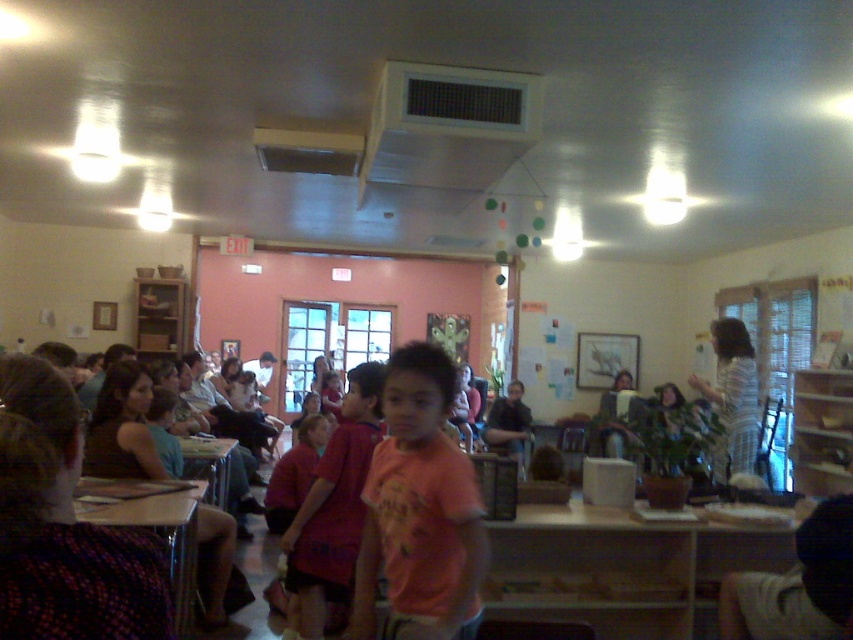
Is pink fabric shirt at center wider than wooden desk at center?

In fact, pink fabric shirt at center might be narrower than wooden desk at center.

Is pink fabric shirt at center positioned before wooden desk at center?

That is True.

You are a GUI agent. You are given a task and a screenshot of the screen. Output one action in this format:
    pyautogui.click(x=<x>, y=<y>)
    Task: Click on the pink fabric shirt at center
    The width and height of the screenshot is (853, 640).
    Given the screenshot: What is the action you would take?
    pyautogui.click(x=334, y=509)

Does point (721, 444) lie behind point (192, 444)?

No, it is not.

Which of these two, striped shirt at right or wooden desk at center, stands taller?

striped shirt at right is taller.

Who is more distant from viewer, (757, 433) or (218, 497)?

Positioned behind is point (218, 497).

The height and width of the screenshot is (640, 853). I want to click on striped shirt at right, so click(732, 397).

Who is taller, pink cotton shirt at center or striped shirt at right?

With more height is striped shirt at right.

Identify the location of pink cotton shirt at center. This screenshot has height=640, width=853. (419, 509).

Locate an element on the screen. This screenshot has width=853, height=640. pink cotton shirt at center is located at coordinates (419, 509).